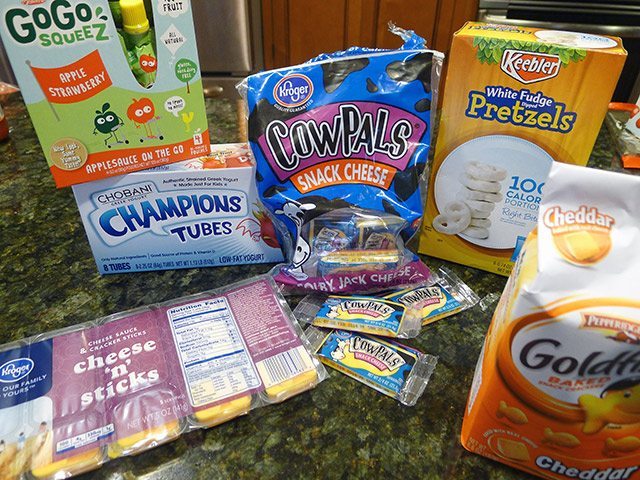
You are a GUI agent. You are given a task and a screenshot of the screen. Output one action in this format:
    pyautogui.click(x=<x>, y=<y>)
    Task: Click on the oven
    The image size is (640, 480).
    Given the screenshot: What is the action you would take?
    (x=589, y=13)